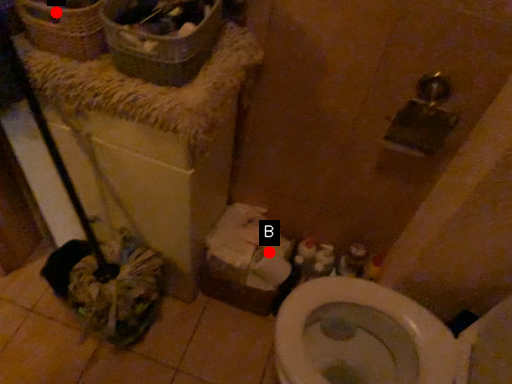
Question: Two points are circled on the image, labeled by A and B beside each circle. Which point is farther from the camera taking this photo?

Choices:
 (A) A is further
 (B) B is further

Answer: (B)